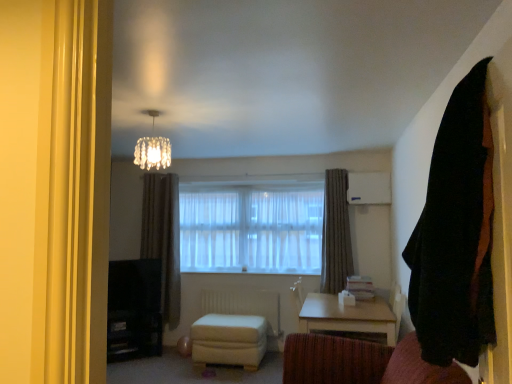
Question: From the image's perspective, is light wood/texture table at lower center located above or below crystal glass chandelier at upper center?

Choices:
 (A) above
 (B) below

Answer: (B)

Question: Do you think light wood/texture table at lower center is within crystal glass chandelier at upper center, or outside of it?

Choices:
 (A) inside
 (B) outside

Answer: (B)

Question: Which is nearer to the black fabric curtain at right, placed as the first curtain when sorted from front to back?

Choices:
 (A) crystal glass chandelier at upper center
 (B) white plastic radiator at lower center
 (C) gray textured curtain at center, placed as the 3th curtain when sorted from left to right
 (D) white sheer curtains at center
 (E) light wood/texture table at lower center

Answer: (E)

Question: Considering the real-world distances, which object is farthest from the gray textured curtain at center, positioned as the 2th curtain in back-to-front order?

Choices:
 (A) black fabric curtain at right, positioned as the third curtain in back-to-front order
 (B) crystal glass chandelier at upper center
 (C) light wood/texture table at lower center
 (D) white sheer curtains at center
 (E) white plastic radiator at lower center

Answer: (A)